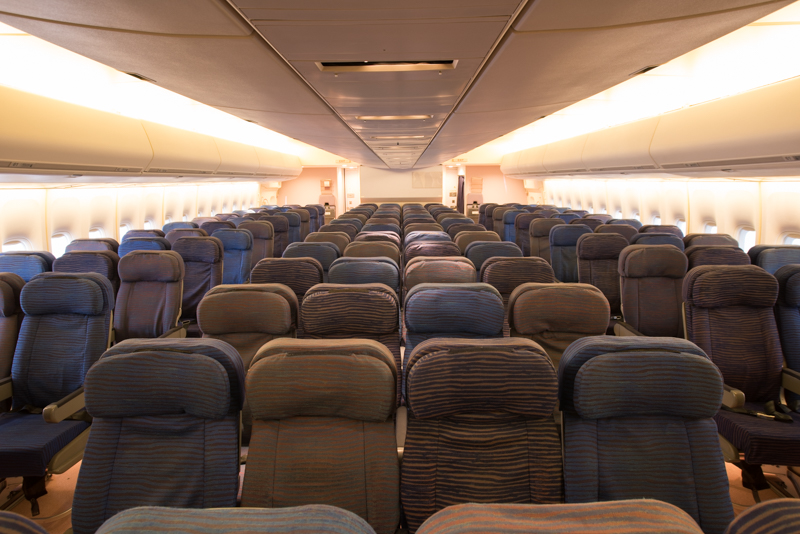
You are a GUI agent. You are given a task and a screenshot of the screen. Output one action in this format:
    pyautogui.click(x=<x>, y=<y>)
    Task: Click on the door
    The image size is (800, 534).
    Given the screenshot: What is the action you would take?
    pyautogui.click(x=112, y=147), pyautogui.click(x=198, y=151), pyautogui.click(x=250, y=162), pyautogui.click(x=276, y=164), pyautogui.click(x=757, y=131), pyautogui.click(x=630, y=139), pyautogui.click(x=566, y=157), pyautogui.click(x=520, y=160)